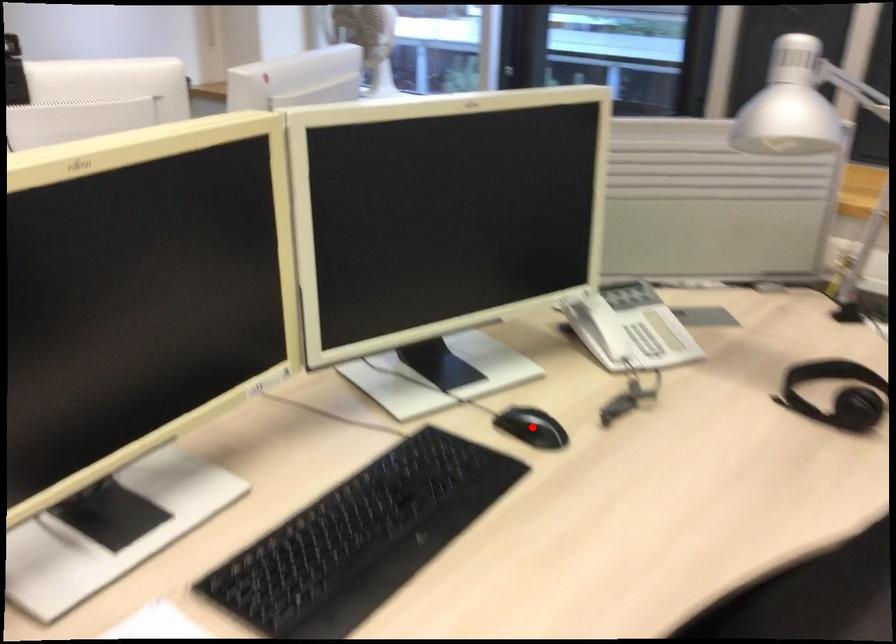
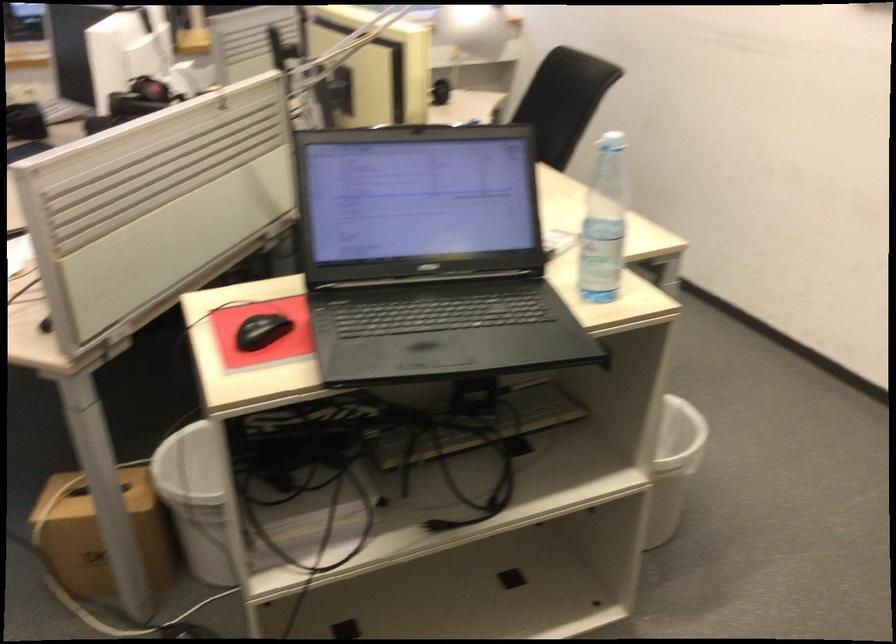
Question: I am providing you with two images of the same scene from different viewpoints. A red point is marked on the first image. At the location where the point appears in image 1, is it still visible in image 2?

Choices:
 (A) Yes
 (B) No

Answer: (B)